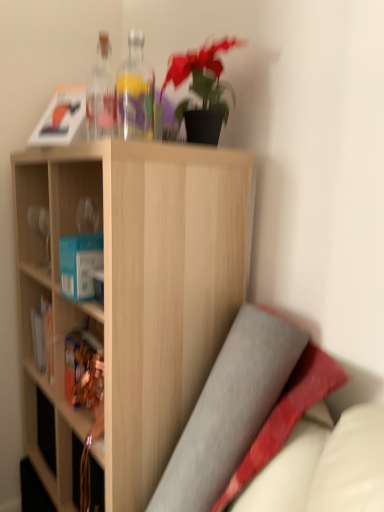
Find the location of a particular element. The height and width of the screenshot is (512, 384). matte brown book at left is located at coordinates (83, 373).

Find the location of `light wood shelf at center`. light wood shelf at center is located at coordinates (133, 294).

In order to face transparent glass bottle at upper center, positioned as the second bottle in left-to-right order, should I rotate leftwards or rightwards?

You should look left and rotate roughly 7.081 degrees.

Where is `matte brown book at left`? This screenshot has width=384, height=512. matte brown book at left is located at coordinates pyautogui.click(x=83, y=373).

Is transparent glass bottle at upper center, placed as the first bottle when sorted from right to left, located outside matte brown book at left?

Absolutely, transparent glass bottle at upper center, placed as the first bottle when sorted from right to left, is external to matte brown book at left.

From a real-world perspective, which object stands above the other?

transparent glass bottle at upper center, placed as the first bottle when sorted from right to left.

Does transparent glass bottle at upper center, positioned as the second bottle in left-to-right order, have a larger size compared to matte brown book at left?

Yes, transparent glass bottle at upper center, positioned as the second bottle in left-to-right order, is bigger than matte brown book at left.

From the picture: From the image's perspective, relative to matte brown book at left, is transparent glass bottle at upper center, placed as the first bottle when sorted from right to left, above or below?

Clearly, from the image's perspective, transparent glass bottle at upper center, placed as the first bottle when sorted from right to left, is above matte brown book at left.

Which of these two, light wood shelf at center or matte brown book at left, is wider?

With larger width is light wood shelf at center.

From a real-world perspective, relative to matte brown book at left, is light wood shelf at center vertically above or below?

From a real-world perspective, light wood shelf at center is physically below matte brown book at left.

Would you say light wood shelf at center is outside matte brown book at left?

Absolutely, light wood shelf at center is external to matte brown book at left.

Would you consider light wood shelf at center to be distant from matte brown book at left?

No.

Who is taller, transparent glass bottle at upper center, positioned as the second bottle in left-to-right order, or transparent glass bottles at upper center, which is counted as the first bottle, starting from the left?

transparent glass bottles at upper center, which is counted as the first bottle, starting from the left, is taller.

Which is further, (147, 69) or (95, 114)?

Point (147, 69)

Identify the location of bottle that is in front of the transparent glass bottles at upper center, which is counted as the first bottle, starting from the left. (135, 92).

How much distance is there between matte brown book at left and transparent glass bottles at upper center, which is counted as the first bottle, starting from the left?

matte brown book at left is 26.92 inches away from transparent glass bottles at upper center, which is counted as the first bottle, starting from the left.

Visually, is matte brown book at left positioned to the left or to the right of transparent glass bottles at upper center, the 2th bottle from the right?

From the image, it's evident that matte brown book at left is to the left of transparent glass bottles at upper center, the 2th bottle from the right.

Could you tell me if matte brown book at left is turned towards transparent glass bottles at upper center, the 2th bottle from the right?

No.

Are matte brown book at left and transparent glass bottles at upper center, which is counted as the first bottle, starting from the left, far apart?

They are positioned close to each other.

Is transparent glass bottle at upper center, positioned as the second bottle in left-to-right order, next to light wood shelf at center?

No, transparent glass bottle at upper center, positioned as the second bottle in left-to-right order, is not in contact with light wood shelf at center.

Is transparent glass bottle at upper center, placed as the first bottle when sorted from right to left, surrounding light wood shelf at center?

No, light wood shelf at center is not a part of transparent glass bottle at upper center, placed as the first bottle when sorted from right to left.

Between transparent glass bottle at upper center, positioned as the second bottle in left-to-right order, and light wood shelf at center, which one has smaller size?

With smaller size is transparent glass bottle at upper center, positioned as the second bottle in left-to-right order.

Which of these two, transparent glass bottle at upper center, placed as the first bottle when sorted from right to left, or light wood shelf at center, is wider?

With larger width is light wood shelf at center.

You are a GUI agent. You are given a task and a screenshot of the screen. Output one action in this format:
    pyautogui.click(x=<x>, y=<y>)
    Task: Click on the shelf located underneath the transparent glass bottles at upper center, which is counted as the first bottle, starting from the left (from a real-world perspective)
    The width and height of the screenshot is (384, 512).
    Given the screenshot: What is the action you would take?
    pyautogui.click(x=133, y=294)

Which of these two, light wood shelf at center or transparent glass bottles at upper center, the 2th bottle from the right, is bigger?

light wood shelf at center.

Considering the positions of points (221, 336) and (87, 100), is point (221, 336) farther from camera compared to point (87, 100)?

That is False.

Based on their positions, is light wood shelf at center located to the left or right of transparent glass bottles at upper center, the 2th bottle from the right?

light wood shelf at center is positioned on transparent glass bottles at upper center, the 2th bottle from the right,'s left side.

Are matte brown book at left and transparent glass bottle at upper center, placed as the first bottle when sorted from right to left, beside each other?

No, matte brown book at left is not with transparent glass bottle at upper center, placed as the first bottle when sorted from right to left.

Consider the image. Which is in front, matte brown book at left or transparent glass bottle at upper center, positioned as the second bottle in left-to-right order?

transparent glass bottle at upper center, positioned as the second bottle in left-to-right order, is more forward.

Is point (97, 382) farther from viewer compared to point (131, 50)?

No, it is in front of (131, 50).

Can you confirm if matte brown book at left is shorter than transparent glass bottle at upper center, positioned as the second bottle in left-to-right order?

Yes, matte brown book at left is shorter than transparent glass bottle at upper center, positioned as the second bottle in left-to-right order.

From a real-world perspective, starting from the matte brown book at left, which bottle is the 1st one vertically above it? Please provide its 2D coordinates.

[(135, 92)]

Identify the location of shelf lying below the matte brown book at left (from the image's perspective). (133, 294).

Which object lies nearer to the anchor point light wood shelf at center, matte brown book at left or transparent glass bottle at upper center, positioned as the second bottle in left-to-right order?

matte brown book at left is closer to light wood shelf at center.

Based on the photo, based on their spatial positions, is light wood shelf at center or transparent glass bottles at upper center, the 2th bottle from the right, closer to transparent glass bottle at upper center, positioned as the second bottle in left-to-right order?

transparent glass bottles at upper center, the 2th bottle from the right, is closer to transparent glass bottle at upper center, positioned as the second bottle in left-to-right order.

Consider the image. Based on their spatial positions, is matte brown book at left or transparent glass bottles at upper center, the 2th bottle from the right, closer to light wood shelf at center?

The object closer to light wood shelf at center is matte brown book at left.

From the image, which object appears to be farther from light wood shelf at center, transparent glass bottle at upper center, positioned as the second bottle in left-to-right order, or matte brown book at left?

transparent glass bottle at upper center, positioned as the second bottle in left-to-right order, is positioned further to the anchor light wood shelf at center.

Which object lies nearer to the anchor point transparent glass bottle at upper center, placed as the first bottle when sorted from right to left, transparent glass bottles at upper center, which is counted as the first bottle, starting from the left, or matte brown book at left?

The object closer to transparent glass bottle at upper center, placed as the first bottle when sorted from right to left, is transparent glass bottles at upper center, which is counted as the first bottle, starting from the left.

Based on their spatial positions, is transparent glass bottle at upper center, positioned as the second bottle in left-to-right order, or transparent glass bottles at upper center, which is counted as the first bottle, starting from the left, closer to light wood shelf at center?

The object closer to light wood shelf at center is transparent glass bottles at upper center, which is counted as the first bottle, starting from the left.

Considering their positions, is transparent glass bottle at upper center, positioned as the second bottle in left-to-right order, positioned closer to transparent glass bottles at upper center, which is counted as the first bottle, starting from the left, than light wood shelf at center?

transparent glass bottle at upper center, positioned as the second bottle in left-to-right order, is closer to transparent glass bottles at upper center, which is counted as the first bottle, starting from the left.

Based on the photo, when comparing their distances from transparent glass bottle at upper center, positioned as the second bottle in left-to-right order, does light wood shelf at center or matte brown book at left seem closer?

Based on the image, light wood shelf at center appears to be nearer to transparent glass bottle at upper center, positioned as the second bottle in left-to-right order.

At what (x,y) coordinates should I click in order to perform the action: click on bottle that lies between transparent glass bottles at upper center, which is counted as the first bottle, starting from the left, and matte brown book at left from top to bottom. Please return your answer as a coordinate pair (x, y). The height and width of the screenshot is (512, 384). Looking at the image, I should click on pyautogui.click(x=135, y=92).

Find the location of a particular element. bottle that lies between transparent glass bottles at upper center, the 2th bottle from the right, and light wood shelf at center from top to bottom is located at coordinates (135, 92).

Find the location of a particular element. The width and height of the screenshot is (384, 512). book between transparent glass bottles at upper center, the 2th bottle from the right, and light wood shelf at center vertically is located at coordinates (83, 373).

You are a GUI agent. You are given a task and a screenshot of the screen. Output one action in this format:
    pyautogui.click(x=<x>, y=<y>)
    Task: Click on the book between transparent glass bottle at upper center, placed as the first bottle when sorted from right to left, and light wood shelf at center from top to bottom
    This screenshot has height=512, width=384.
    Given the screenshot: What is the action you would take?
    pyautogui.click(x=83, y=373)